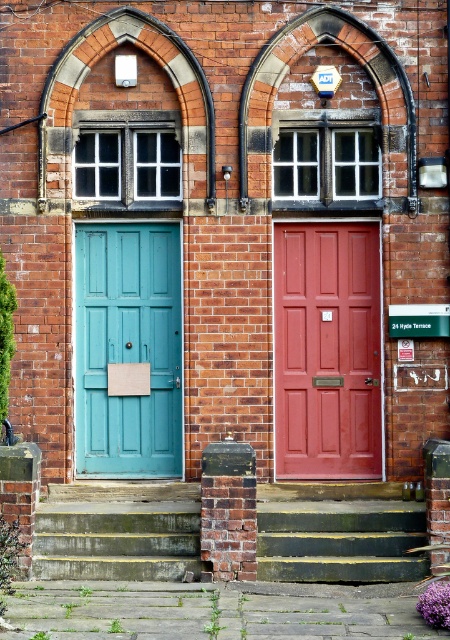
Question: Does matte red door at center appear over teal matte door at left?

Choices:
 (A) no
 (B) yes

Answer: (B)

Question: Based on their relative distances, which object is farther from the matte red door at center?

Choices:
 (A) concrete steps at center
 (B) green painted wood stairs at center

Answer: (A)

Question: Can you confirm if green painted wood stairs at center is positioned above concrete steps at center?

Choices:
 (A) no
 (B) yes

Answer: (B)

Question: Estimate the real-world distances between objects in this image. Which object is closer to the green painted wood stairs at center?

Choices:
 (A) teal matte door at left
 (B) concrete steps at center
 (C) matte red door at center

Answer: (C)

Question: Which of the following is the farthest from the observer?

Choices:
 (A) teal matte door at left
 (B) matte red door at center
 (C) concrete steps at center
 (D) green painted wood stairs at center

Answer: (A)

Question: Is matte red door at center closer to camera compared to teal matte door at left?

Choices:
 (A) yes
 (B) no

Answer: (A)